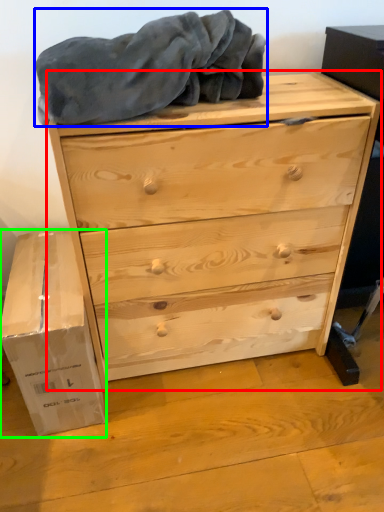
Question: Which is nearer to the chest of drawers (highlighted by a red box)? blanket (highlighted by a blue box) or cardboard box (highlighted by a green box).

Choices:
 (A) blanket
 (B) cardboard box

Answer: (A)